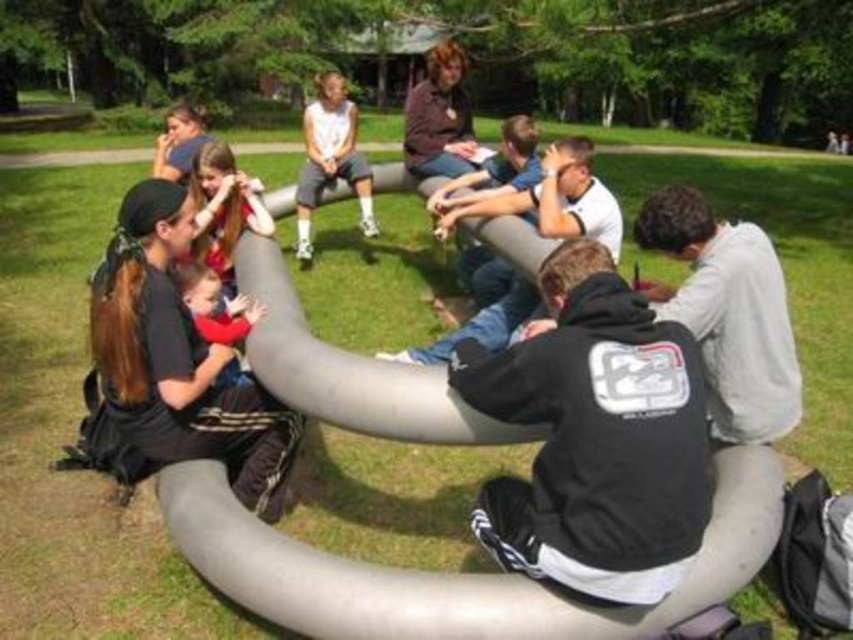
Question: Is the position of gray matte jacket at lower right more distant than that of matte red shirt at center?

Choices:
 (A) no
 (B) yes

Answer: (A)

Question: Which object is positioned farthest from the gray matte jacket at lower right?

Choices:
 (A) black matte shirt at lower left
 (B) matte red shirt at center
 (C) white matte shorts at center

Answer: (C)

Question: Does black fleece jacket at center appear over gray matte jacket at lower right?

Choices:
 (A) yes
 (B) no

Answer: (B)

Question: Which of the following is the farthest from the observer?

Choices:
 (A) (213, 353)
 (B) (741, 250)
 (C) (335, 157)
 (D) (199, 291)

Answer: (C)

Question: Can you confirm if black matte shirt at lower left is bigger than matte red shirt at center?

Choices:
 (A) no
 (B) yes

Answer: (B)

Question: Which object appears farthest from the camera in this image?

Choices:
 (A) white matte shorts at center
 (B) matte red shirt at center
 (C) black fleece jacket at center

Answer: (A)